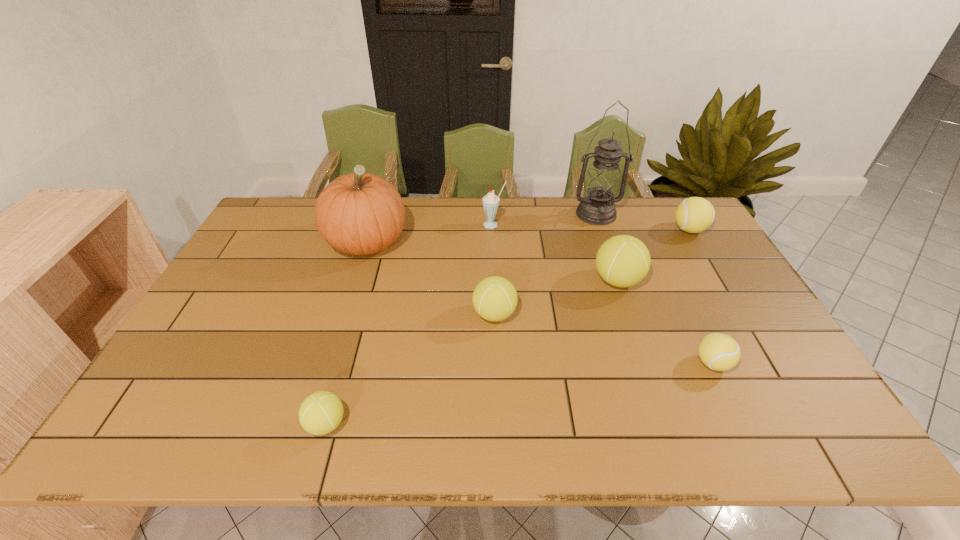
Image resolution: width=960 pixels, height=540 pixels. Find the location of `vacant area located on the back of the third farthest tennis ball`. vacant area located on the back of the third farthest tennis ball is located at coordinates (492, 262).

Identify the location of vacant space situated on the back of the fourth farthest tennis ball. The height and width of the screenshot is (540, 960). (684, 304).

Identify the location of vacant region located on the back of the smallest green tennis ball. (363, 295).

I want to click on oil lamp present at the far edge, so click(x=602, y=182).

Locate an element on the screen. The width and height of the screenshot is (960, 540). pumpkin present at the far edge is located at coordinates (360, 213).

This screenshot has height=540, width=960. I want to click on milkshake that is at the far edge, so click(490, 201).

Locate an element on the screen. The image size is (960, 540). tennis ball located in the far edge section of the desktop is located at coordinates (695, 214).

Locate an element on the screen. The image size is (960, 540). object that is at the near edge is located at coordinates (320, 413).

Where is `object positioned at the far right corner`? This screenshot has width=960, height=540. object positioned at the far right corner is located at coordinates (695, 214).

Image resolution: width=960 pixels, height=540 pixels. In the image, there is a desktop. What are the coordinates of `vacant region at the far edge` in the screenshot? It's located at tap(477, 218).